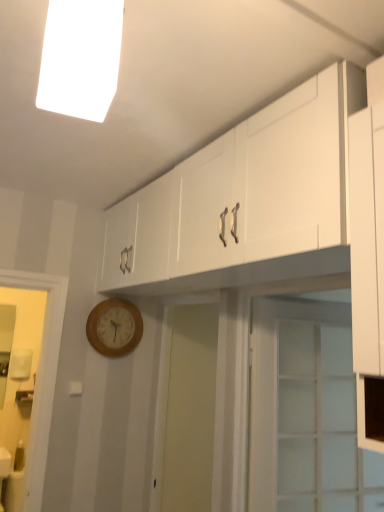
Question: Considering the relative sizes of white fluorescent light at upper center and white glossy cabinet at upper center in the image provided, is white fluorescent light at upper center bigger than white glossy cabinet at upper center?

Choices:
 (A) yes
 (B) no

Answer: (B)

Question: Does white fluorescent light at upper center touch white glossy cabinet at upper center?

Choices:
 (A) yes
 (B) no

Answer: (B)

Question: Can you confirm if white fluorescent light at upper center is taller than white glossy cabinet at upper center?

Choices:
 (A) no
 (B) yes

Answer: (A)

Question: From a real-world perspective, is white fluorescent light at upper center on top of white glossy cabinet at upper center?

Choices:
 (A) no
 (B) yes

Answer: (B)

Question: Is white fluorescent light at upper center wider than white glossy cabinet at upper center?

Choices:
 (A) no
 (B) yes

Answer: (A)

Question: Is white fluorescent light at upper center not close to white glossy cabinet at upper center?

Choices:
 (A) yes
 (B) no

Answer: (B)

Question: Is white glossy cabinet at upper center smaller than clear glass door at center?

Choices:
 (A) yes
 (B) no

Answer: (B)

Question: Can you confirm if white glossy cabinet at upper center is bigger than clear glass door at center?

Choices:
 (A) yes
 (B) no

Answer: (A)

Question: From a real-world perspective, is white glossy cabinet at upper center positioned under clear glass door at center based on gravity?

Choices:
 (A) no
 (B) yes

Answer: (A)

Question: Is white glossy cabinet at upper center oriented towards clear glass door at center?

Choices:
 (A) yes
 (B) no

Answer: (B)

Question: From a real-world perspective, does white glossy cabinet at upper center stand above clear glass door at center?

Choices:
 (A) yes
 (B) no

Answer: (A)

Question: Considering the relative positions of white glossy cabinet at upper center and clear glass door at center in the image provided, is white glossy cabinet at upper center behind clear glass door at center?

Choices:
 (A) no
 (B) yes

Answer: (A)

Question: Is white fluorescent light at upper center positioned in front of wooden wall clock at lower left?

Choices:
 (A) no
 (B) yes

Answer: (B)